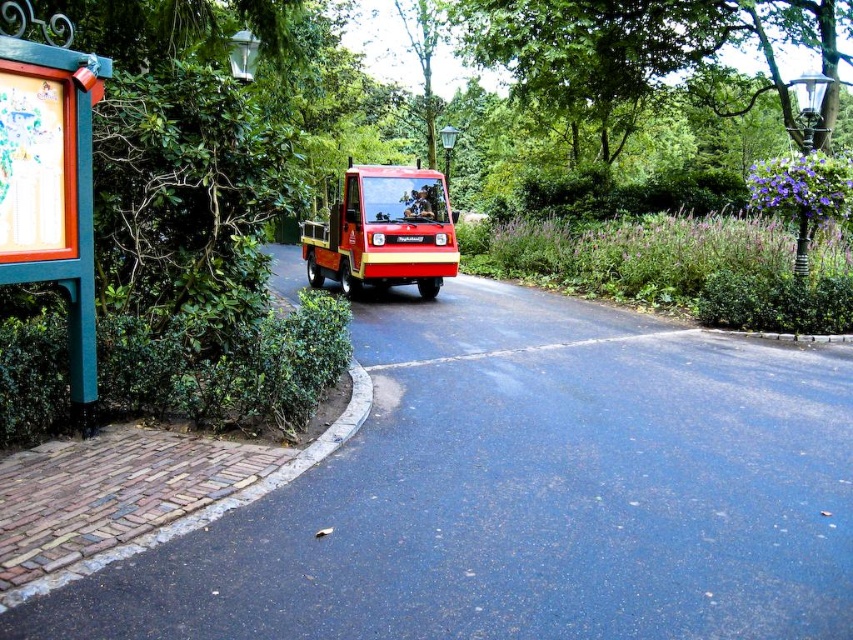
Question: Does wooden signboard at left come in front of red matte utility vehicle at center?

Choices:
 (A) yes
 (B) no

Answer: (A)

Question: Which of these objects is positioned farthest from the red matte utility vehicle at center?

Choices:
 (A) green leafy hedge at left
 (B) wooden signboard at left

Answer: (B)

Question: Where is wooden signboard at left located in relation to red matte utility vehicle at center in the image?

Choices:
 (A) above
 (B) below

Answer: (B)

Question: Which is nearer to the wooden signboard at left?

Choices:
 (A) red matte utility vehicle at center
 (B) green leafy hedge at left

Answer: (B)

Question: Which of these objects is positioned farthest from the green leafy hedge at left?

Choices:
 (A) wooden signboard at left
 (B) red matte utility vehicle at center

Answer: (B)

Question: Is green leafy hedge at left above wooden signboard at left?

Choices:
 (A) no
 (B) yes

Answer: (A)